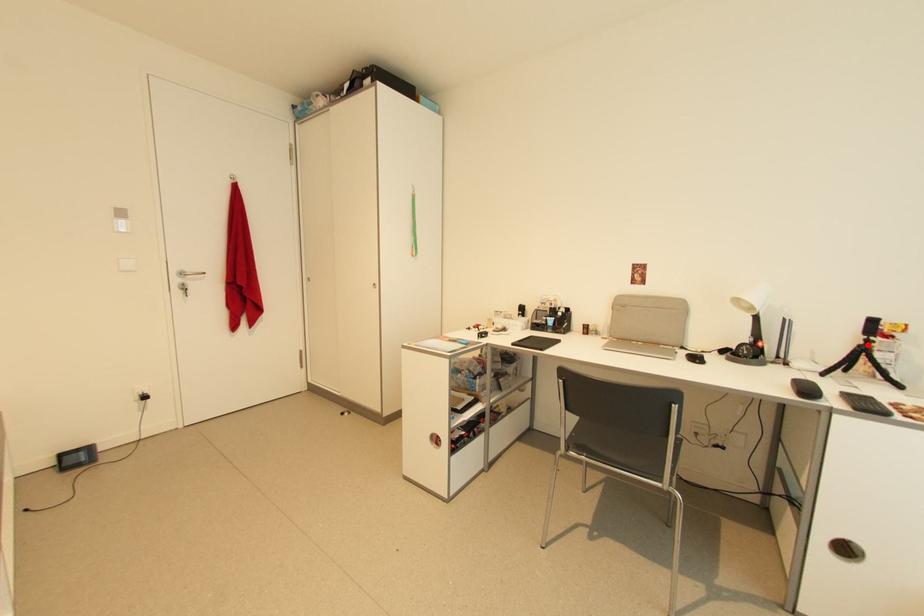
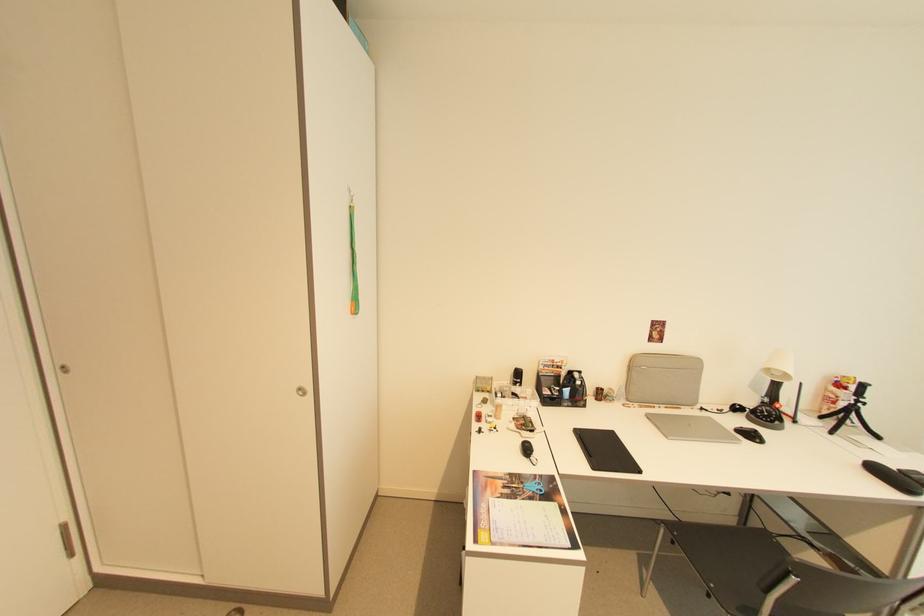
Where in the second image is the point corresponding to the highlighted location from the first image?

(857, 405)